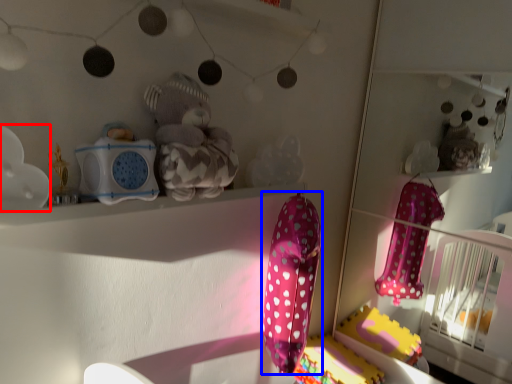
Question: Among these objects, which one is farthest to the camera, toy (highlighted by a red box) or baby clothe (highlighted by a blue box)?

Choices:
 (A) toy
 (B) baby clothe

Answer: (B)